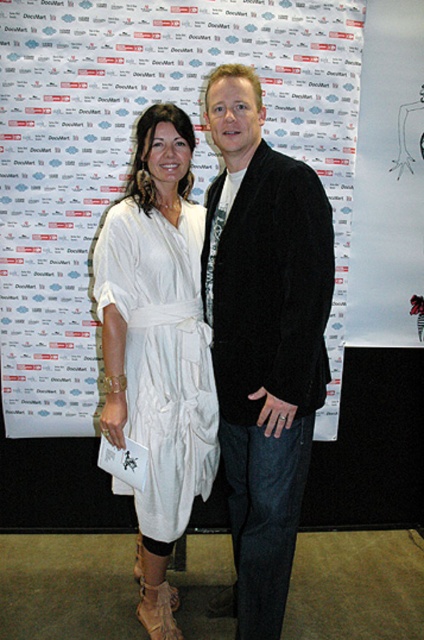
Question: Can you confirm if white paper at center is wider than white cotton dress at center?

Choices:
 (A) yes
 (B) no

Answer: (A)

Question: Estimate the real-world distances between objects in this image. Which object is closer to the white cotton dress at center?

Choices:
 (A) white paper at center
 (B) black fuzzy jacket at center

Answer: (B)

Question: Is white paper at center further to the viewer compared to white cotton dress at center?

Choices:
 (A) no
 (B) yes

Answer: (B)

Question: Is white paper at center bigger than black fuzzy jacket at center?

Choices:
 (A) no
 (B) yes

Answer: (B)

Question: Among these objects, which one is nearest to the camera?

Choices:
 (A) white paper at center
 (B) white cotton dress at center
 (C) black fuzzy jacket at center

Answer: (C)

Question: Which point is closer to the camera?

Choices:
 (A) (55, 390)
 (B) (161, 284)

Answer: (B)